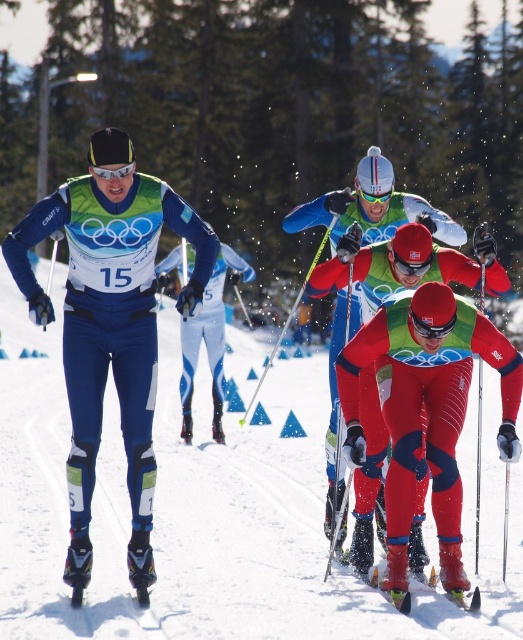
Looking at this image, can you confirm if matte blue ski suit at center is positioned to the left of red matte ski suit at center?

Indeed, matte blue ski suit at center is positioned on the left side of red matte ski suit at center.

Is matte blue ski suit at center above red matte ski suit at center?

Correct, matte blue ski suit at center is located above red matte ski suit at center.

You are a GUI agent. You are given a task and a screenshot of the screen. Output one action in this format:
    pyautogui.click(x=<x>, y=<y>)
    Task: Click on the matte blue ski suit at center
    The image size is (523, 640).
    Given the screenshot: What is the action you would take?
    pyautogui.click(x=109, y=324)

Identify the location of matte blue ski suit at center. Image resolution: width=523 pixels, height=640 pixels. (109, 324).

Who is more distant from viewer, (22, 259) or (408, 605)?

The point (408, 605) is behind.

Locate an element on the screen. This screenshot has height=640, width=523. matte blue ski suit at center is located at coordinates (109, 324).

I want to click on matte blue ski suit at center, so click(x=109, y=324).

Is red matte ski suit at center to the right of green matte ski at center from the viewer's perspective?

Yes, red matte ski suit at center is to the right of green matte ski at center.

Is red matte ski suit at center taller than green matte ski at center?

Correct, red matte ski suit at center is much taller as green matte ski at center.

The image size is (523, 640). Describe the element at coordinates (427, 412) in the screenshot. I see `red matte ski suit at center` at that location.

You are a GUI agent. You are given a task and a screenshot of the screen. Output one action in this format:
    pyautogui.click(x=<x>, y=<y>)
    Task: Click on the red matte ski suit at center
    This screenshot has width=523, height=640.
    Given the screenshot: What is the action you would take?
    pyautogui.click(x=427, y=412)